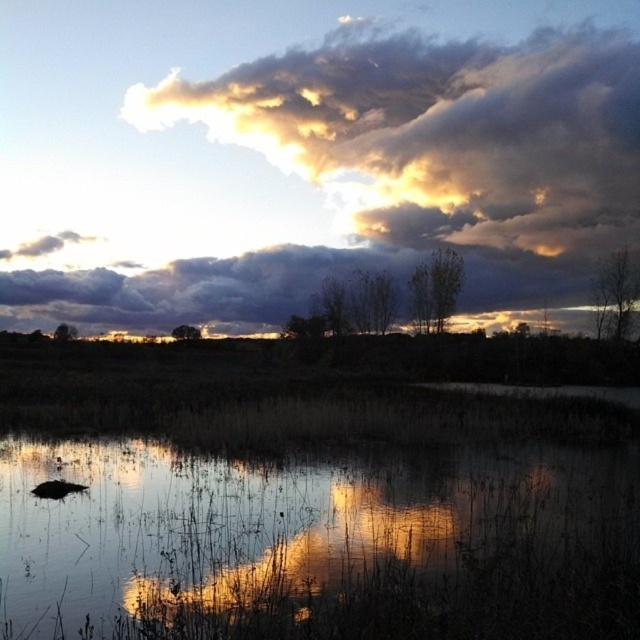
Describe the element at coordinates (276, 518) in the screenshot. I see `transparent water at center` at that location.

Who is higher up, transparent water at center or cloudy sky at upper center?

cloudy sky at upper center

Is point (330, 529) positioned in front of point (540, 180)?

Yes, it is in front of point (540, 180).

The image size is (640, 640). Identify the location of transparent water at center. (276, 518).